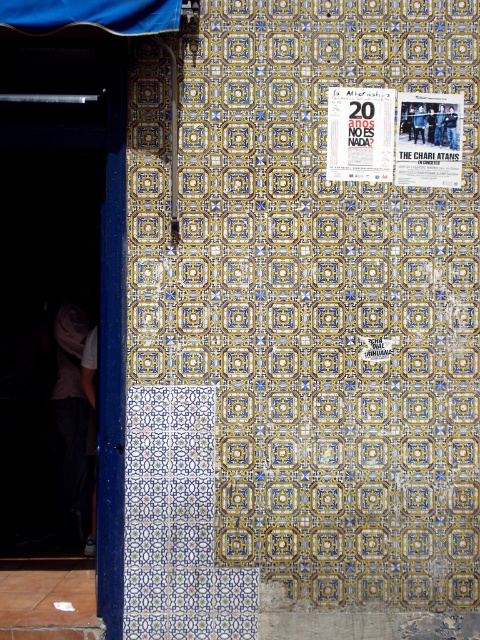
Between blue painted wood at left and matte paper poster at upper right, which one appears on the left side from the viewer's perspective?

blue painted wood at left

Can you confirm if blue painted wood at left is taller than matte paper poster at upper right?

Yes, blue painted wood at left is taller than matte paper poster at upper right.

Measure the distance between point (108, 316) and camera.

Point (108, 316) is 17.85 feet from camera.

The image size is (480, 640). In order to click on blue painted wood at left in this screenshot , I will do `click(112, 346)`.

Is blue painted wood at left above white paper poster at upper center?

Actually, blue painted wood at left is below white paper poster at upper center.

At what (x,y) coordinates should I click in order to perform the action: click on blue painted wood at left. Please return your answer as a coordinate pair (x, y). The image size is (480, 640). Looking at the image, I should click on (112, 346).

Does white paper poster at upper center have a smaller size compared to matte paper poster at upper right?

Incorrect, white paper poster at upper center is not smaller in size than matte paper poster at upper right.

Can you confirm if white paper poster at upper center is positioned below matte paper poster at upper right?

No, white paper poster at upper center is not below matte paper poster at upper right.

Which is in front, point (387, 97) or point (408, 100)?

Point (387, 97) is more forward.

Where is `white paper poster at upper center`? This screenshot has width=480, height=640. white paper poster at upper center is located at coordinates (360, 132).